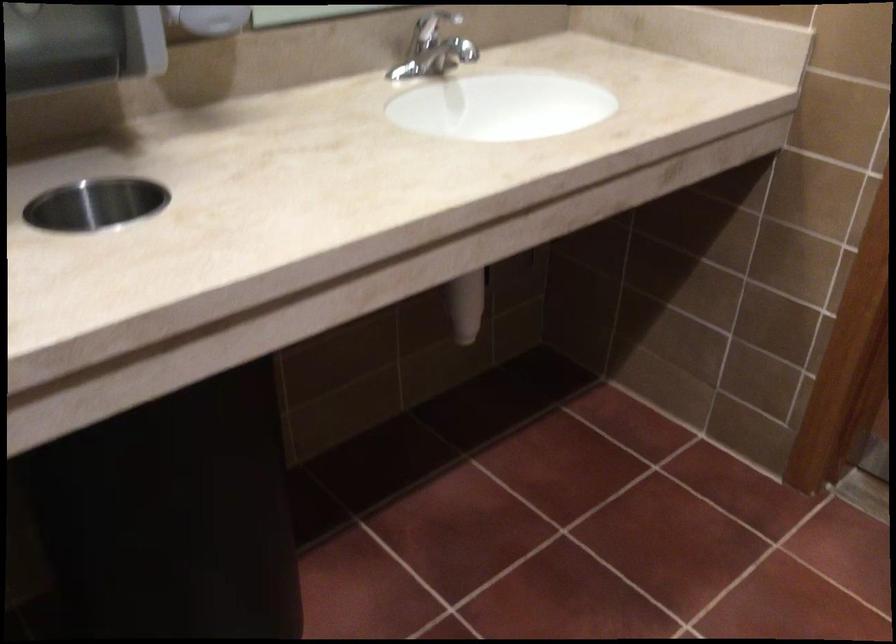
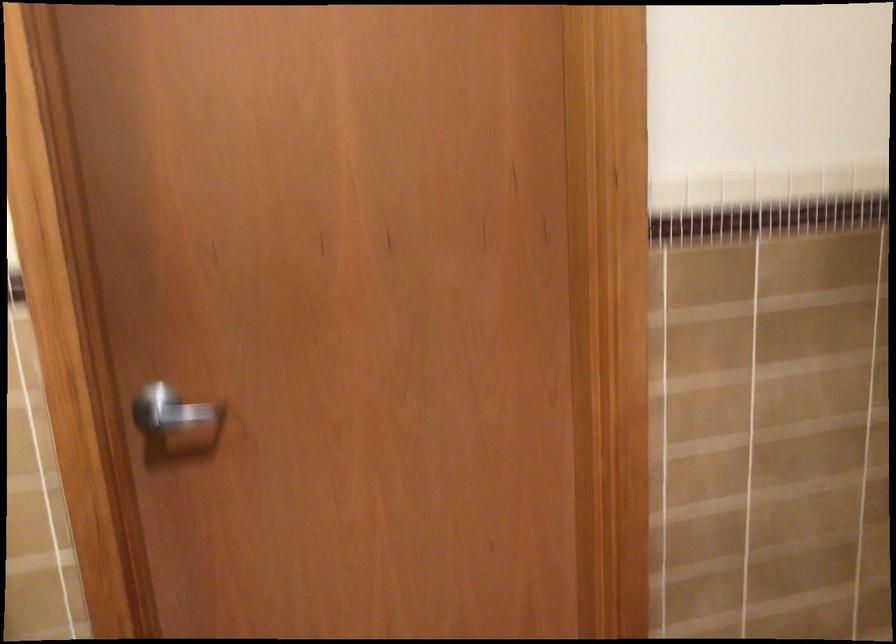
Question: The images are taken continuously from a first-person perspective. In which direction is your viewpoint rotating?

Choices:
 (A) Left
 (B) Right
 (C) Up
 (D) Down

Answer: (B)